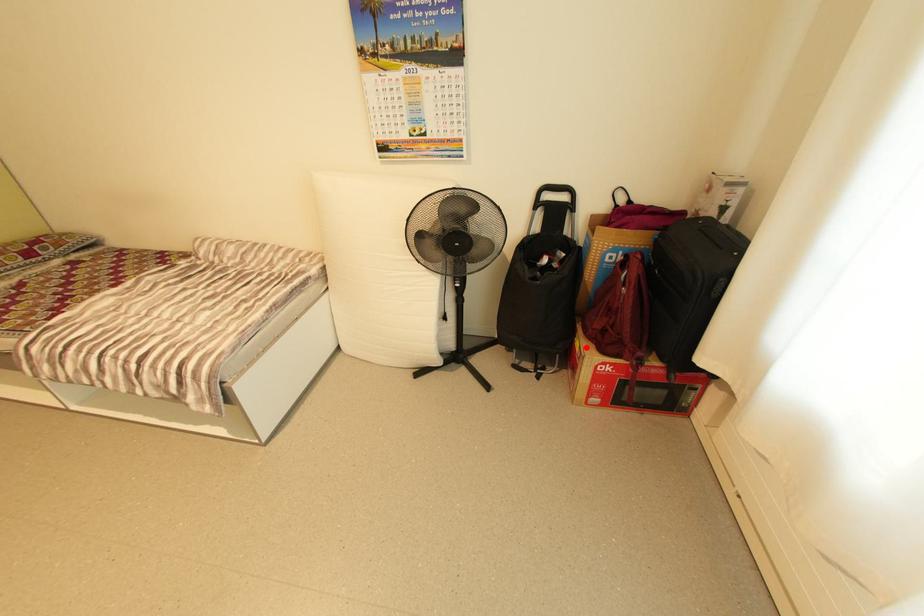
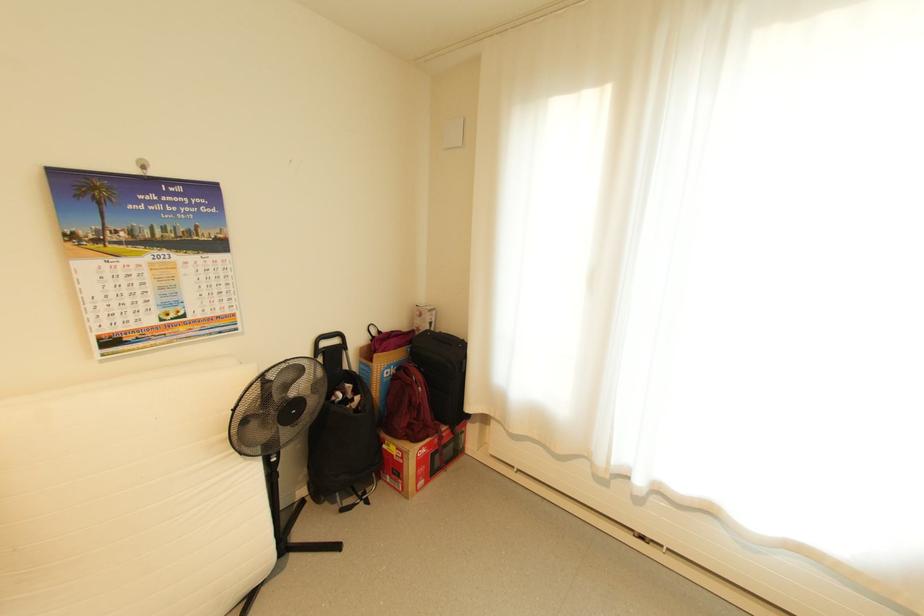
Question: I am providing you with two images of the same scene from different viewpoints. In image1, a red point is highlighted. Considering the same 3D point in image2, which of the following is correct?

Choices:
 (A) It is closer
 (B) It is farther

Answer: (B)